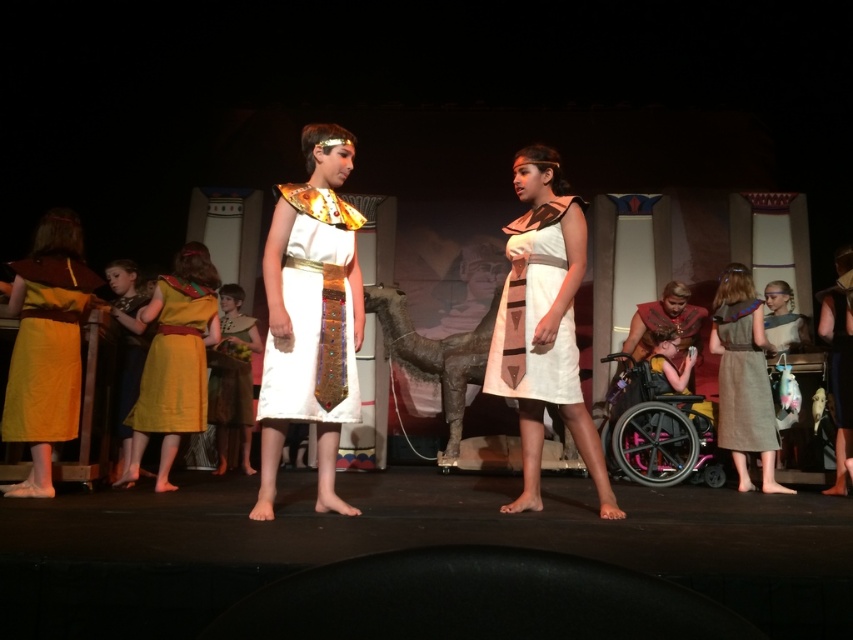
Can you confirm if white cotton dress at center is thinner than yellow satin dress at left?

Incorrect, white cotton dress at center's width is not less than yellow satin dress at left's.

From the picture: Does white cotton dress at center appear under yellow satin dress at left?

No, white cotton dress at center is not below yellow satin dress at left.

Is point (576, 413) closer to camera compared to point (212, 296)?

Yes, it is in front of point (212, 296).

This screenshot has width=853, height=640. What are the coordinates of `white cotton dress at center` in the screenshot? It's located at (544, 324).

Can you confirm if matte yellow dress at left is bigger than brown textured dress at right?

No.

Who is more forward, (76, 401) or (735, 328)?

Point (76, 401) is more forward.

Locate an element on the screen. The height and width of the screenshot is (640, 853). matte yellow dress at left is located at coordinates (47, 352).

In the scene shown: Who is positioned more to the right, white cotton dress at center or pink plastic wheelchair at lower right?

pink plastic wheelchair at lower right

Does white cotton dress at center come behind pink plastic wheelchair at lower right?

No, white cotton dress at center is in front of pink plastic wheelchair at lower right.

Between point (569, 324) and point (663, 433), which one is positioned behind?

Point (663, 433)

At what (x,y) coordinates should I click in order to perform the action: click on white cotton dress at center. Please return your answer as a coordinate pair (x, y). Looking at the image, I should click on (544, 324).